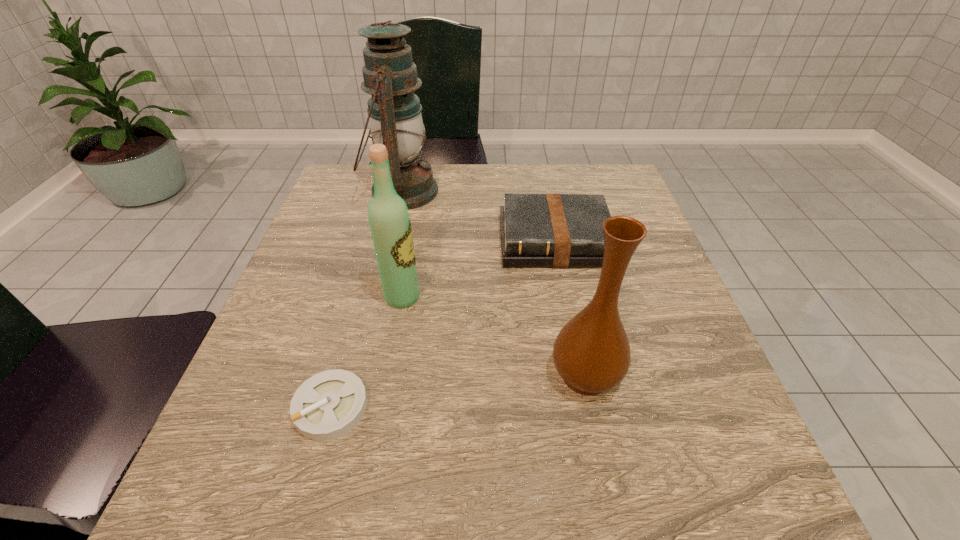
Find the location of `the second closest object to the hardback book`. the second closest object to the hardback book is located at coordinates (390, 225).

The image size is (960, 540). In order to click on vacant point that satisfies the following two spatial constraints: 1. on the spine side of the second shortest object; 2. on the front-facing side of the wine bottle in this screenshot , I will do `click(566, 297)`.

At what (x,y) coordinates should I click in order to perform the action: click on free region that satisfies the following two spatial constraints: 1. on the spine side of the hardback book; 2. on the left side of the vase. Please return your answer as a coordinate pair (x, y). The height and width of the screenshot is (540, 960). Looking at the image, I should click on (582, 375).

This screenshot has width=960, height=540. What are the coordinates of `blank space that satisfies the following two spatial constraints: 1. on the spine side of the fourth tallest object; 2. on the front-facing side of the third nearest object` in the screenshot? It's located at (566, 297).

You are a GUI agent. You are given a task and a screenshot of the screen. Output one action in this format:
    pyautogui.click(x=<x>, y=<y>)
    Task: Click on the vacant position in the image that satisfies the following two spatial constraints: 1. on the spine side of the hardback book; 2. on the front-facing side of the wine bottle
    This screenshot has width=960, height=540.
    Given the screenshot: What is the action you would take?
    pyautogui.click(x=566, y=297)